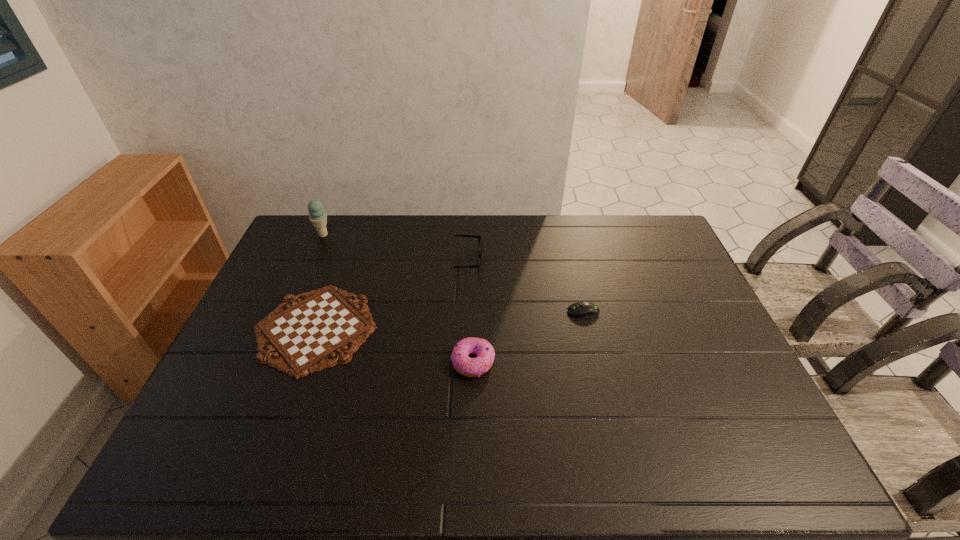
Locate an element on the screen. The height and width of the screenshot is (540, 960). the farthest object is located at coordinates (318, 217).

Locate an element on the screen. This screenshot has height=540, width=960. ice cream is located at coordinates (318, 217).

At what (x,y) coordinates should I click in order to perform the action: click on spectacles. Please return your answer as a coordinate pair (x, y). The image size is (960, 540). Looking at the image, I should click on (480, 250).

Locate an element on the screen. the second farthest object is located at coordinates click(x=480, y=250).

Find the location of a particular element. The image size is (960, 540). the third shortest object is located at coordinates (471, 367).

The width and height of the screenshot is (960, 540). Identify the location of computer mouse. (580, 309).

Image resolution: width=960 pixels, height=540 pixels. Find the location of `the rightmost object`. the rightmost object is located at coordinates (580, 309).

Where is `the shortest object`? Image resolution: width=960 pixels, height=540 pixels. the shortest object is located at coordinates (304, 335).

I want to click on blank space located 0.360m on the front of the ice cream, so click(x=289, y=312).

At what (x,y) coordinates should I click in order to perform the action: click on vacant space situated 0.340m on the front-facing side of the second farthest object. Please return your answer as a coordinate pair (x, y). Image resolution: width=960 pixels, height=540 pixels. Looking at the image, I should click on (582, 262).